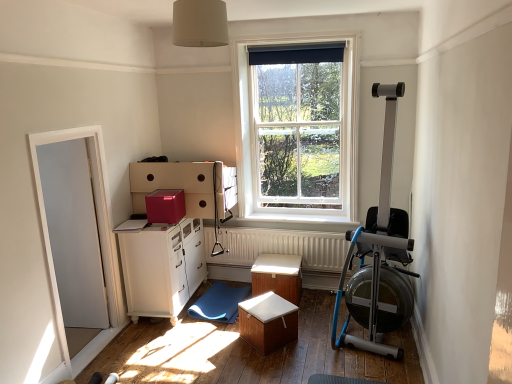
Question: Is black fabric curtain at upper center wider than white wooden window at center?

Choices:
 (A) yes
 (B) no

Answer: (B)

Question: Considering the relative sizes of black fabric curtain at upper center and white wooden window at center in the image provided, is black fabric curtain at upper center shorter than white wooden window at center?

Choices:
 (A) no
 (B) yes

Answer: (B)

Question: Is black fabric curtain at upper center not within white wooden window at center?

Choices:
 (A) no
 (B) yes

Answer: (A)

Question: Can you confirm if black fabric curtain at upper center is taller than white wooden window at center?

Choices:
 (A) yes
 (B) no

Answer: (B)

Question: Could you tell me if black fabric curtain at upper center is facing white wooden window at center?

Choices:
 (A) yes
 (B) no

Answer: (B)

Question: Is the depth of black fabric curtain at upper center greater than that of white wooden window at center?

Choices:
 (A) yes
 (B) no

Answer: (B)

Question: Is silver metallic rowing machine at right positioned behind white glossy door at left?

Choices:
 (A) no
 (B) yes

Answer: (B)

Question: From the image's perspective, is silver metallic rowing machine at right under white glossy door at left?

Choices:
 (A) yes
 (B) no

Answer: (B)

Question: From a real-world perspective, is silver metallic rowing machine at right over white glossy door at left?

Choices:
 (A) yes
 (B) no

Answer: (A)

Question: Can you confirm if silver metallic rowing machine at right is positioned to the left of white glossy door at left?

Choices:
 (A) yes
 (B) no

Answer: (B)

Question: Is silver metallic rowing machine at right in front of white glossy door at left?

Choices:
 (A) yes
 (B) no

Answer: (B)

Question: Does silver metallic rowing machine at right turn towards white glossy door at left?

Choices:
 (A) yes
 (B) no

Answer: (B)

Question: Is wooden table at center, which appears as the 2th table when viewed from the back, at the back of white glossy cabinet at lower left?

Choices:
 (A) no
 (B) yes

Answer: (A)